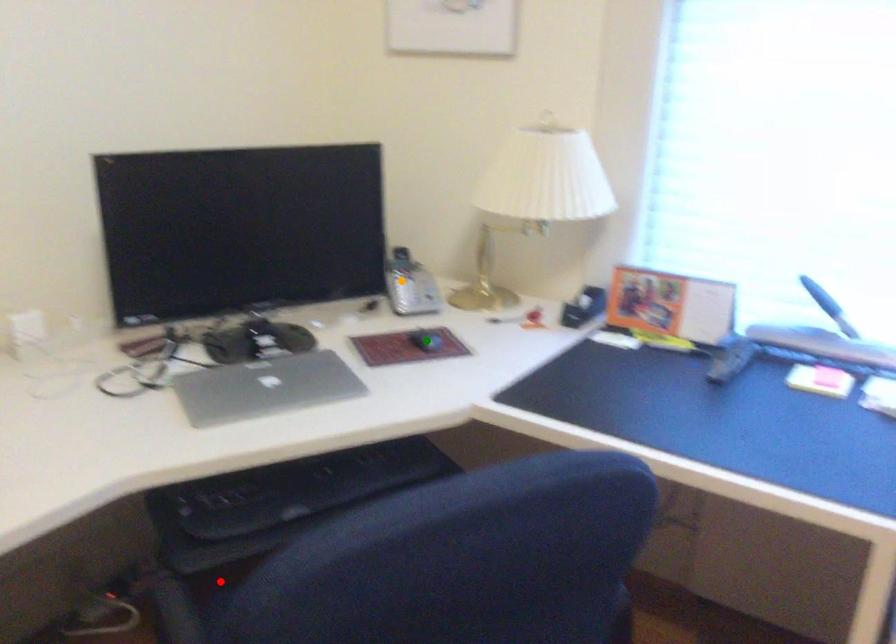
Based on the photo, order these from nearest to farthest:
orange point, green point, red point

red point, green point, orange point